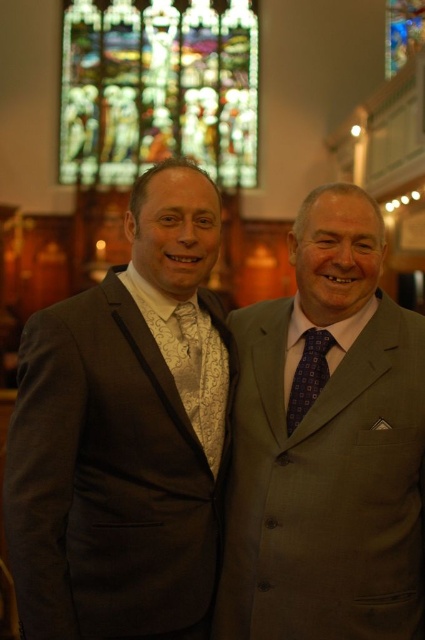
You are standing in the church and see the stained glass window. There is a point at coordinates (308, 376). What object is located at that point?

The point at coordinates (308, 376) corresponds to the purple dotted tie at center.

You are an interior designer assessing the space for a photoshoot. You need to ensure that the dark gray wool suit at left and the stained glass window at upper center are both visible in the frame. Given their sizes, which object should you prioritize positioning closer to the camera to maintain clarity in the photograph?

The dark gray wool suit at left is bigger than the stained glass window at upper center. To maintain clarity, prioritize positioning the stained glass window at upper center closer to the camera since smaller objects require closer focus for detail retention.

You are standing in a church and need to locate the dark gray wool suit at left. Where exactly should you look in the room?

The dark gray wool suit at left is located at point 0.745 on the x axis and 0.254 on the y axis.